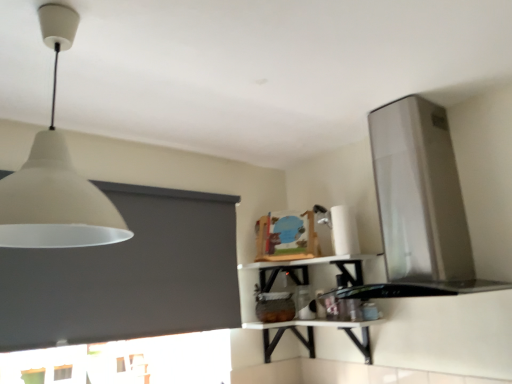
Describe the element at coordinates (56, 177) in the screenshot. I see `white matte lampshade at upper left` at that location.

This screenshot has width=512, height=384. I want to click on white glossy counter top at lower center, so click(343, 373).

You are a GUI agent. You are given a task and a screenshot of the screen. Output one action in this format:
    pyautogui.click(x=<x>, y=<y>)
    Task: Click on the dark gray matte window screen at upper left
    
    Given the screenshot: What is the action you would take?
    pyautogui.click(x=128, y=275)

From a real-world perspective, is white glossy counter top at lower center over satin silver vent at upper right?

No, from a real-world perspective, white glossy counter top at lower center is not over satin silver vent at upper right

Consider the image. Is white glossy counter top at lower center wider than satin silver vent at upper right?

Incorrect, the width of white glossy counter top at lower center does not surpass that of satin silver vent at upper right.

Considering the points (353, 374) and (424, 195), which point is behind, point (353, 374) or point (424, 195)?

Point (353, 374)

Is white glossy counter top at lower center further to the viewer compared to satin silver vent at upper right?

Yes, white glossy counter top at lower center is behind satin silver vent at upper right.

Is the position of satin silver vent at upper right less distant than that of white glossy table at center?

Yes, satin silver vent at upper right is closer to the camera.

Locate an element on the screen. The width and height of the screenshot is (512, 384). table lying behind the satin silver vent at upper right is located at coordinates (313, 334).

From the image's perspective, is satin silver vent at upper right on white glossy table at center?

Indeed, from the image's perspective, satin silver vent at upper right is shown above white glossy table at center.

How distant is satin silver vent at upper right from white glossy table at center?

The distance of satin silver vent at upper right from white glossy table at center is 58.98 centimeters.

In order to click on counter top below the white matte lampshade at upper left (from the image's perspective) in this screenshot , I will do `click(343, 373)`.

Between white matte lampshade at upper left and white glossy counter top at lower center, which one is positioned in front?

white matte lampshade at upper left is in front.

Measure the distance from white matte lampshade at upper left to white glossy counter top at lower center.

white matte lampshade at upper left and white glossy counter top at lower center are 1.46 meters apart from each other.

Does white matte lampshade at upper left turn towards white glossy counter top at lower center?

Yes.

Which is closer to the camera, (64, 303) or (298, 335)?

Point (64, 303)

Between dark gray matte window screen at upper left and white glossy shelf at upper center, which one has smaller size?

With smaller size is white glossy shelf at upper center.

Consider the image. Is dark gray matte window screen at upper left oriented away from white glossy shelf at upper center?

That's not correct — dark gray matte window screen at upper left is not looking away from white glossy shelf at upper center.

Does dark gray matte window screen at upper left have a lesser height compared to white glossy shelf at upper center?

No, dark gray matte window screen at upper left is not shorter than white glossy shelf at upper center.

Is white matte lampshade at upper left looking in the opposite direction of dark gray matte window screen at upper left?

That's not correct — white matte lampshade at upper left is not looking away from dark gray matte window screen at upper left.

In terms of width, does white matte lampshade at upper left look wider or thinner when compared to dark gray matte window screen at upper left?

Clearly, white matte lampshade at upper left has more width compared to dark gray matte window screen at upper left.

Locate an element on the screen. window screen below the white matte lampshade at upper left (from a real-world perspective) is located at coordinates (128, 275).

Is white glossy counter top at lower center positioned far away from white glossy table at center?

No, there isn't a large distance between white glossy counter top at lower center and white glossy table at center.

Does white glossy counter top at lower center have a smaller size compared to white glossy table at center?

Correct, white glossy counter top at lower center occupies less space than white glossy table at center.

Could you tell me if white glossy counter top at lower center is facing white glossy table at center?

No, white glossy counter top at lower center does not turn towards white glossy table at center.

From a real-world perspective, which is physically above, white glossy counter top at lower center or white glossy table at center?

In real-world perspective, white glossy table at center is above.

In the scene shown: Could you tell me if white matte lampshade at upper left is facing satin silver vent at upper right?

Yes, white matte lampshade at upper left is aimed at satin silver vent at upper right.

Visually, is white matte lampshade at upper left positioned to the left or to the right of satin silver vent at upper right?

Clearly, white matte lampshade at upper left is on the left of satin silver vent at upper right in the image.

Can we say white matte lampshade at upper left lies outside satin silver vent at upper right?

Yes.

From a real-world perspective, which is physically above, white matte lampshade at upper left or satin silver vent at upper right?

From a 3D spatial view, white matte lampshade at upper left is above.

Identify the location of counter top below the satin silver vent at upper right (from the image's perspective). This screenshot has width=512, height=384. (343, 373).

Find the location of `table to the left of satin silver vent at upper right`. table to the left of satin silver vent at upper right is located at coordinates (313, 334).

Looking at the image, which one is located closer to white glossy shelf at upper center, white glossy counter top at lower center or white glossy table at center?

Among the two, white glossy table at center is located nearer to white glossy shelf at upper center.

Looking at the image, which one is located further to white glossy counter top at lower center, white glossy table at center or satin silver vent at upper right?

The object further to white glossy counter top at lower center is satin silver vent at upper right.

Looking at the image, which one is located further to white glossy counter top at lower center, white glossy shelf at upper center or white glossy table at center?

white glossy shelf at upper center.

When comparing their distances from satin silver vent at upper right, does white glossy shelf at upper center or white glossy counter top at lower center seem further?

The object further to satin silver vent at upper right is white glossy counter top at lower center.

From the image, which object appears to be nearer to white glossy shelf at upper center, dark gray matte window screen at upper left or white glossy table at center?

white glossy table at center is positioned closer to the anchor white glossy shelf at upper center.

Estimate the real-world distances between objects in this image. Which object is closer to satin silver vent at upper right, dark gray matte window screen at upper left or white glossy table at center?

white glossy table at center is positioned closer to the anchor satin silver vent at upper right.

Estimate the real-world distances between objects in this image. Which object is closer to white glossy table at center, white matte lampshade at upper left or dark gray matte window screen at upper left?

dark gray matte window screen at upper left lies closer to white glossy table at center than the other object.

Looking at the image, which one is located closer to white glossy counter top at lower center, white glossy shelf at upper center or dark gray matte window screen at upper left?

The object closer to white glossy counter top at lower center is white glossy shelf at upper center.

At what (x,y) coordinates should I click in order to perform the action: click on table between white matte lampshade at upper left and white glossy counter top at lower center vertically. Please return your answer as a coordinate pair (x, y). The width and height of the screenshot is (512, 384). Looking at the image, I should click on (313, 334).

At what (x,y) coordinates should I click in order to perform the action: click on shelf between white matte lampshade at upper left and satin silver vent at upper right. Please return your answer as a coordinate pair (x, y). Looking at the image, I should click on (311, 336).

This screenshot has width=512, height=384. Identify the location of table between satin silver vent at upper right and white glossy counter top at lower center in the up-down direction. (313, 334).

Find the location of a particular element. shelf situated between dark gray matte window screen at upper left and white glossy counter top at lower center from left to right is located at coordinates (311, 336).